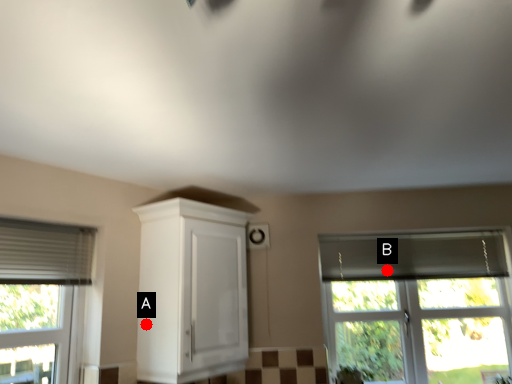
Question: Two points are circled on the image, labeled by A and B beside each circle. Which point is closer to the camera?

Choices:
 (A) A is closer
 (B) B is closer

Answer: (A)